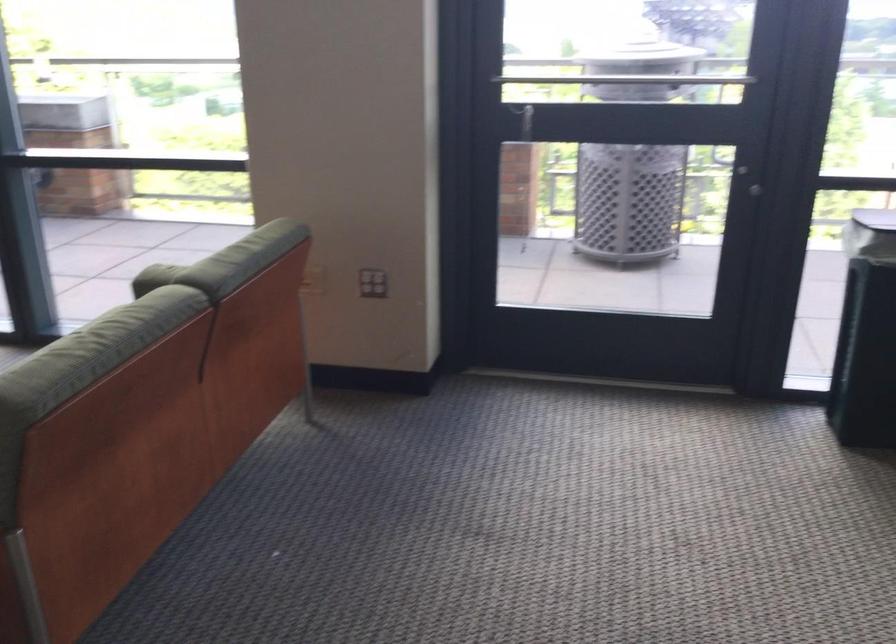
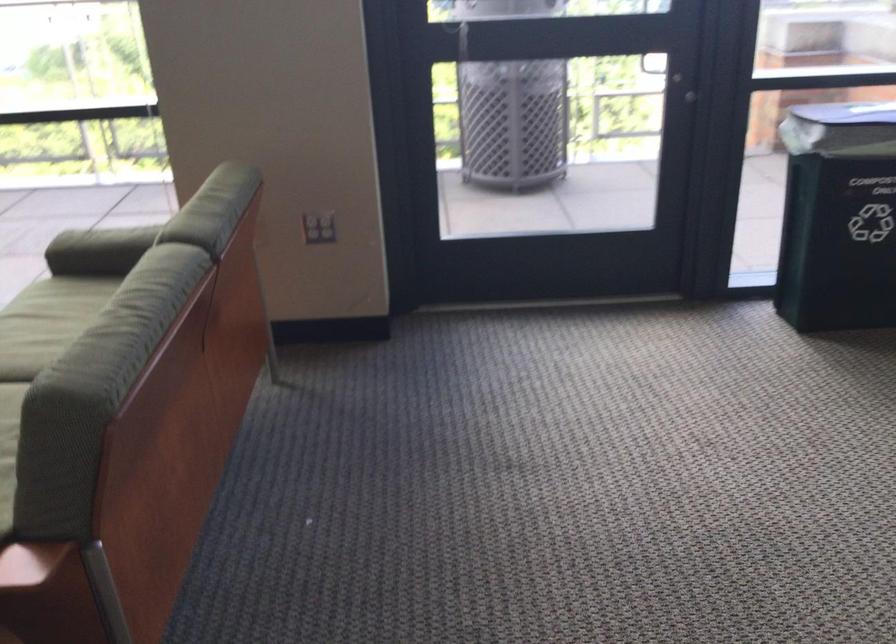
Where in the second image is the point corresponding to [372,281] from the first image?

(319, 227)